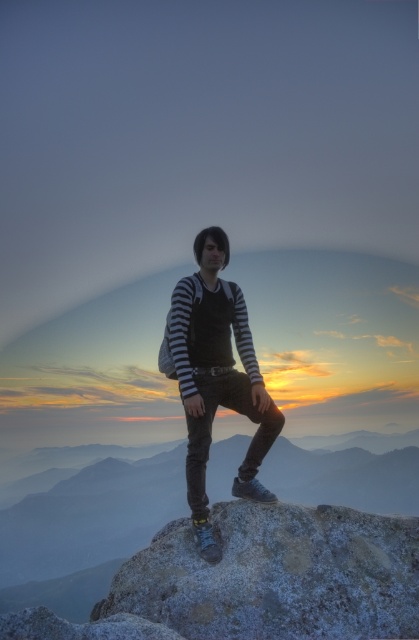
You are a photographer positioned at the base of the rocky outcrop in the scene. You want to capture a photo that includes both the point at coordinates point (x=331, y=550) and point (x=248, y=337). Since you want the closer point to be in focus, which point should you focus on?

You should focus on point (x=331, y=550) because it is closer to the viewer than point (x=248, y=337) according to the description.

You are a hiker who wants to take a photo of the sunset with the frosty rock at center and striped fabric shirt at center in the frame. Which object should you position to the left to ensure both are visible in the photo?

You should position the striped fabric shirt at center to the left since the frosty rock at center is already to the right of it.